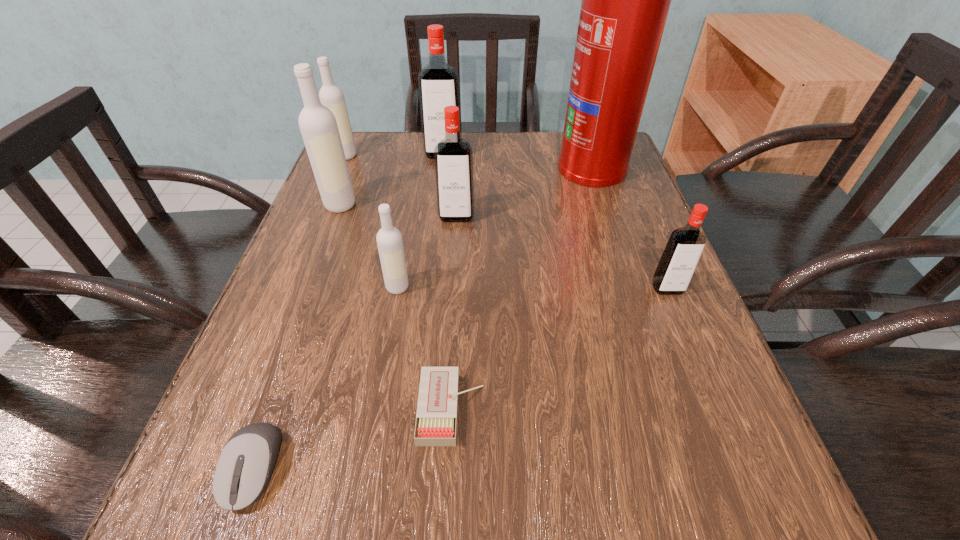
Locate an element on the screen. The image size is (960, 540). the tallest object is located at coordinates (625, 2).

Find the location of a particular element. fire extinguisher is located at coordinates (625, 2).

The height and width of the screenshot is (540, 960). Find the location of `the biggest white vodka`. the biggest white vodka is located at coordinates (318, 126).

Identify the location of the biggest red vodka. coord(438,82).

Image resolution: width=960 pixels, height=540 pixels. In order to click on the farthest white vodka in this screenshot , I will do `click(331, 96)`.

The image size is (960, 540). Identify the location of the second smallest red vodka. coord(453,156).

Locate an element on the screen. The image size is (960, 540). the nearest white vodka is located at coordinates (389, 240).

This screenshot has height=540, width=960. Find the location of `the smallest white vodka`. the smallest white vodka is located at coordinates (389, 240).

Where is `the rightmost red vodka`? This screenshot has height=540, width=960. the rightmost red vodka is located at coordinates (683, 250).

At what (x,y) coordinates should I click in order to perform the action: click on the smallest red vodka. Please return your answer as a coordinate pair (x, y). Looking at the image, I should click on (683, 250).